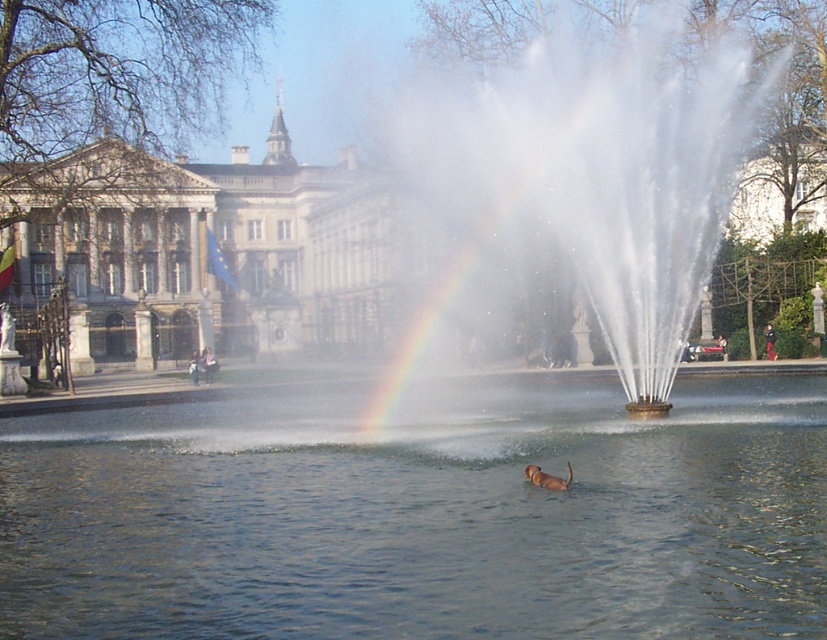
You are standing in the park and want to take a photo of the white stone building at upper left and the white water at center. Where should you position yourself to capture both in the frame?

Position yourself so that the white stone building at upper left is in the upper part of your frame and the white water at center is below it, as the white water at center is located below the white stone building at upper left.

You are a photographer planning to capture the fountain and the building in the background. Based on the scene, which object between the clear water at center and the white stone building at upper left would appear narrower in your photo?

The clear water at center is thinner than the white stone building at upper left, so it would appear narrower in the photo.

You are standing at the edge of the fountain and want to take a photo of the dog swimming in the fountain. The dog is at point (653, 179). There is a bench at point (80, 179). To avoid the bench blocking your view, which point should you focus on to capture the dog clearly?

You should focus on point (653, 179) because it is closer to the camera than point (80, 179), so the bench at point (80, 179) will not block the view of the dog.